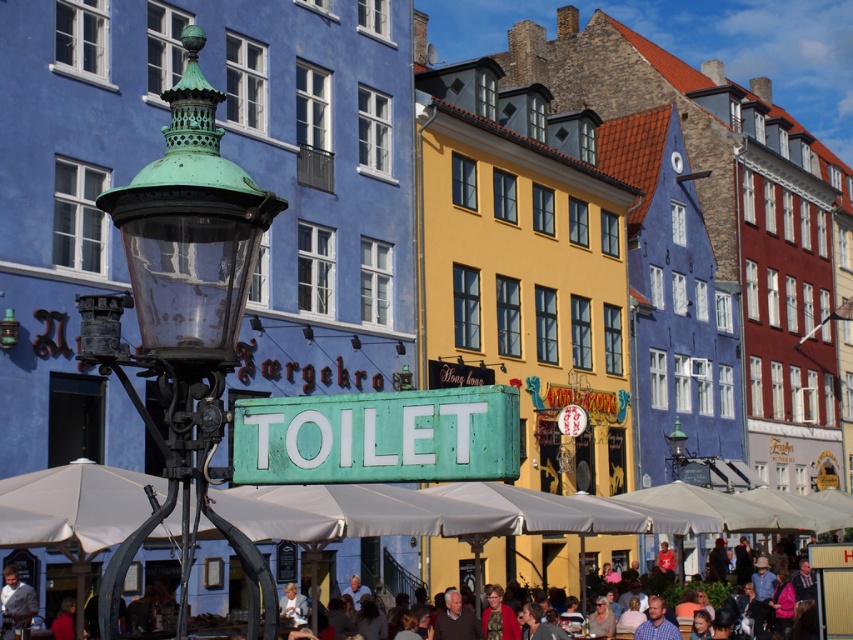
Does green patina metal streetlamp at upper left appear under light brown leather jacket at lower left?

Incorrect, green patina metal streetlamp at upper left is not positioned below light brown leather jacket at lower left.

Does green patina metal streetlamp at upper left have a larger size compared to light brown leather jacket at lower left?

Yes.

Identify the location of green patina metal streetlamp at upper left. (184, 321).

Image resolution: width=853 pixels, height=640 pixels. In order to click on green patina metal streetlamp at upper left in this screenshot , I will do `click(184, 321)`.

Can you confirm if green patina metal streetlamp at upper left is positioned to the right of light brown wooden chair at lower center?

No, green patina metal streetlamp at upper left is not to the right of light brown wooden chair at lower center.

Does green patina metal streetlamp at upper left appear over light brown wooden chair at lower center?

Yes.

Is point (212, 355) less distant than point (514, 588)?

Yes, it is in front of point (514, 588).

At what (x,y) coordinates should I click in order to perform the action: click on green patina metal streetlamp at upper left. Please return your answer as a coordinate pair (x, y). This screenshot has width=853, height=640. Looking at the image, I should click on (184, 321).

Is green matte toilet sign at center positioned before light brown leather jacket at lower left?

Yes, green matte toilet sign at center is closer to the viewer.

Can you confirm if green matte toilet sign at center is shorter than light brown leather jacket at lower left?

Yes, green matte toilet sign at center is shorter than light brown leather jacket at lower left.

The height and width of the screenshot is (640, 853). What do you see at coordinates (378, 436) in the screenshot?
I see `green matte toilet sign at center` at bounding box center [378, 436].

Where is `green matte toilet sign at center`? The height and width of the screenshot is (640, 853). green matte toilet sign at center is located at coordinates (378, 436).